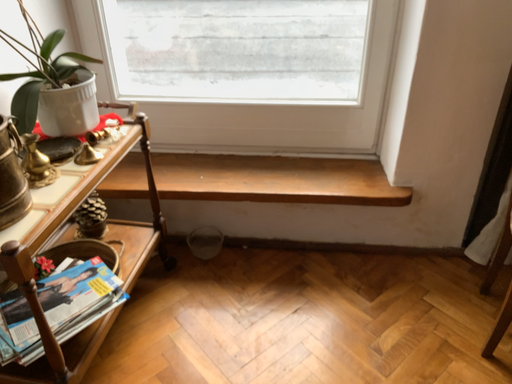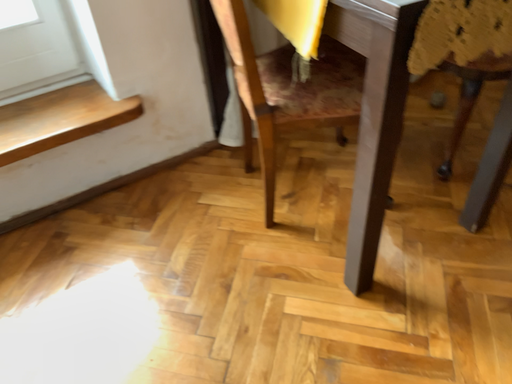
Question: Which way did the camera rotate in the video?

Choices:
 (A) rotated right
 (B) rotated left

Answer: (A)